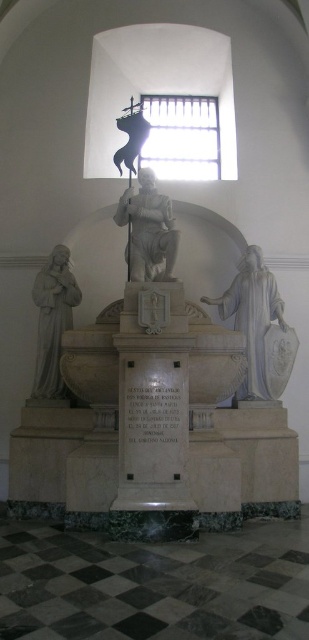
You are an architect designing a new plaza and want to place a 36 inch wide statue between the white marble monument at center and the white marble statue at left. Is there enough space?

The distance between the white marble monument at center and the white marble statue at left is 35.10 inches. Since the statue you want to place is 36 inches wide, it would not fit as the space is slightly narrower than required.

You are standing at the point labeled as point (123,413) in the image. What object is located exactly at that point?

The point (123,413) indicates the white marble monument at center.